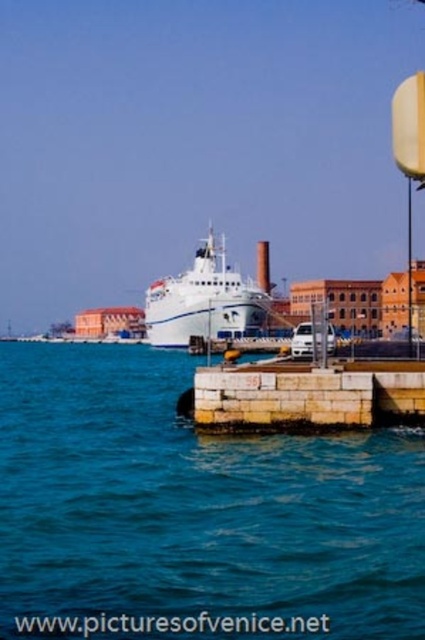
Describe the element at coordinates (192, 512) in the screenshot. The image size is (425, 640). I see `blue water at center` at that location.

Who is positioned more to the left, blue water at center or white glossy cruise ship at center?

white glossy cruise ship at center is more to the left.

Based on the photo, who is more forward, [56,500] or [169,332]?

Positioned in front is point [56,500].

Locate an element on the screen. The image size is (425, 640). blue water at center is located at coordinates (192, 512).